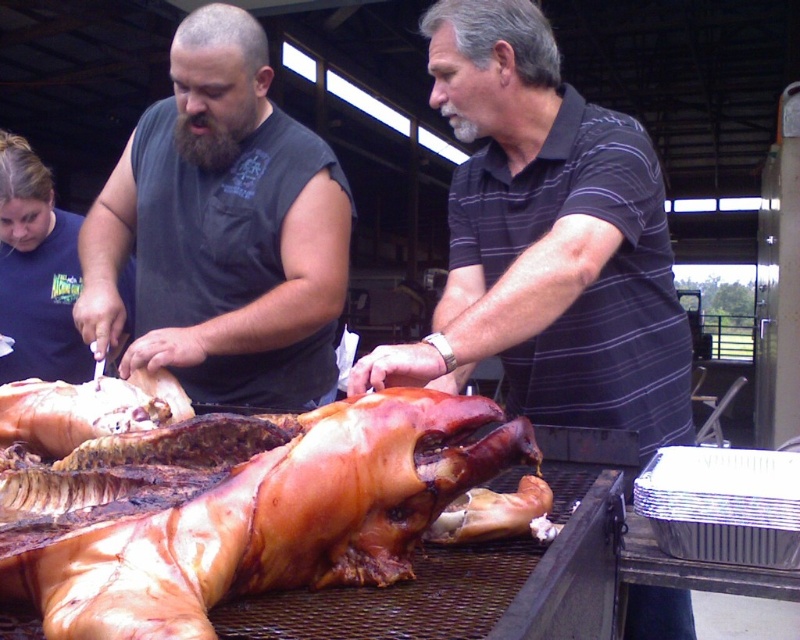
Question: Can you confirm if brown crispy skin at center is positioned to the right of dark gray sleeveless shirt at center?

Choices:
 (A) no
 (B) yes

Answer: (B)

Question: Which point is farther to the camera?

Choices:
 (A) dark gray sleeveless shirt at center
 (B) dark striped shirt at center
 (C) brown crispy skin at center

Answer: (A)

Question: Does dark striped shirt at center appear under dark gray sleeveless shirt at center?

Choices:
 (A) no
 (B) yes

Answer: (B)

Question: Which point is closer to the camera?

Choices:
 (A) [x=558, y=301]
 (B) [x=508, y=440]
 (C) [x=92, y=252]

Answer: (B)

Question: Which object is the farthest from the dark gray sleeveless shirt at center?

Choices:
 (A) brown crispy skin at center
 (B) dark striped shirt at center

Answer: (A)

Question: Does brown crispy skin at center appear over dark gray sleeveless shirt at center?

Choices:
 (A) yes
 (B) no

Answer: (B)